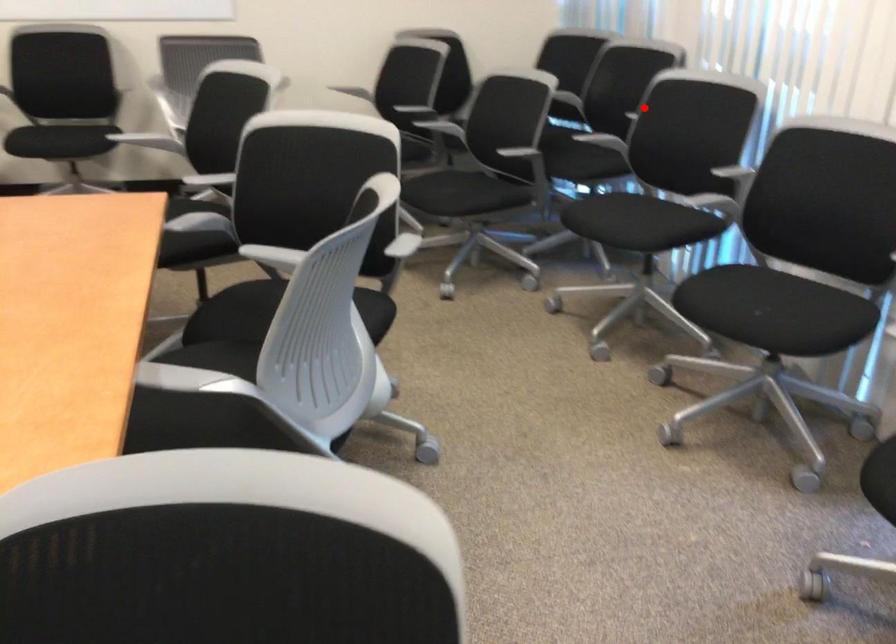
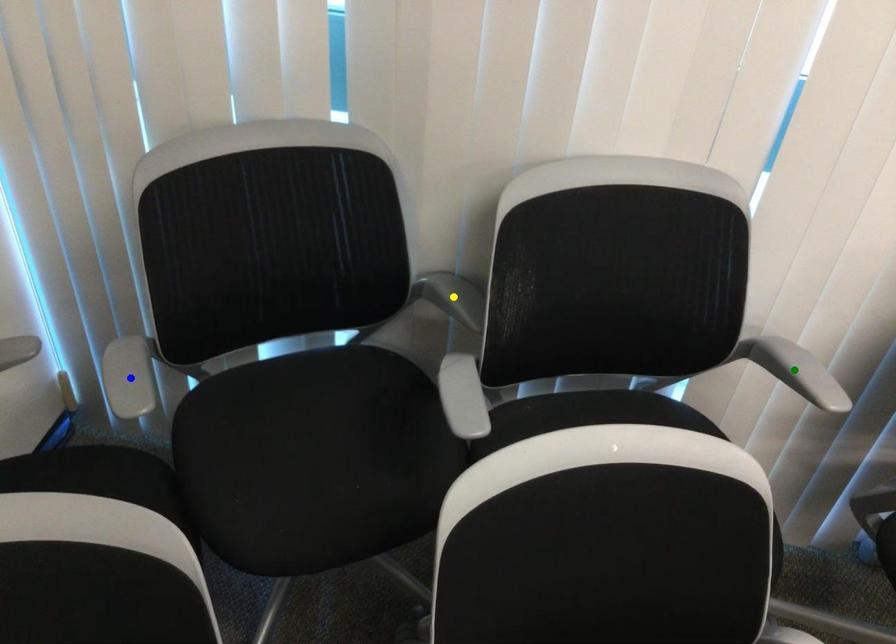
Question: I am providing you with two images of the same scene from different viewpoints. A red point is marked on the first image. You are given multiple points on the second image. Which point in image 2 represents the same 3d spot as the red point in image 1?

Choices:
 (A) yellow point
 (B) green point
 (C) blue point

Answer: (B)